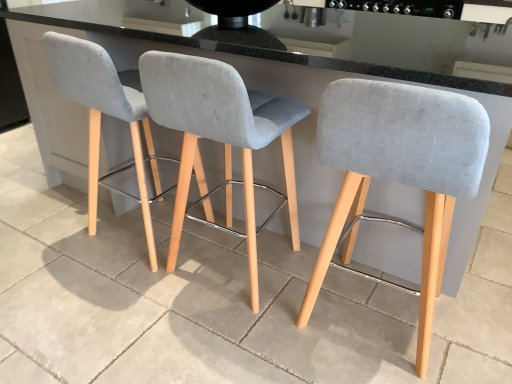
Question: Is black glossy stove at upper center at the back of light gray fabric stool at center, placed as the second chair when sorted from left to right?

Choices:
 (A) no
 (B) yes

Answer: (A)

Question: From a real-world perspective, is light gray fabric stool at center, placed as the second chair when sorted from left to right, located higher than black glossy stove at upper center?

Choices:
 (A) yes
 (B) no

Answer: (B)

Question: Does light gray fabric stool at center, placed as the second chair when sorted from left to right, come behind black glossy stove at upper center?

Choices:
 (A) yes
 (B) no

Answer: (B)

Question: Can you confirm if light gray fabric stool at center, the 2th chair positioned from the right, is positioned to the left of black glossy stove at upper center?

Choices:
 (A) yes
 (B) no

Answer: (A)

Question: Is light gray fabric stool at center, the 2th chair positioned from the right, positioned far away from black glossy stove at upper center?

Choices:
 (A) yes
 (B) no

Answer: (A)

Question: Which is correct: gray concrete at center is inside light gray fabric stool at left, the third chair when ordered from right to left, or outside of it?

Choices:
 (A) outside
 (B) inside

Answer: (A)

Question: From their relative heights in the image, would you say gray concrete at center is taller or shorter than light gray fabric stool at left, which appears as the first chair when viewed from the left?

Choices:
 (A) tall
 (B) short

Answer: (B)

Question: Considering the positions of gray concrete at center and light gray fabric stool at left, which appears as the first chair when viewed from the left, in the image, is gray concrete at center wider or thinner than light gray fabric stool at left, which appears as the first chair when viewed from the left,?

Choices:
 (A) wide
 (B) thin

Answer: (B)

Question: In the image, is gray concrete at center positioned in front of or behind light gray fabric stool at left, the third chair when ordered from right to left?

Choices:
 (A) front
 (B) behind

Answer: (A)

Question: From the image's perspective, relative to black glossy stove at upper center, is light gray fabric stool at left, which appears as the first chair when viewed from the left, above or below?

Choices:
 (A) below
 (B) above

Answer: (A)

Question: In the image, is light gray fabric stool at left, which appears as the first chair when viewed from the left, positioned in front of or behind black glossy stove at upper center?

Choices:
 (A) front
 (B) behind

Answer: (A)

Question: Considering the positions of light gray fabric stool at left, the third chair when ordered from right to left, and black glossy stove at upper center in the image, is light gray fabric stool at left, the third chair when ordered from right to left, bigger or smaller than black glossy stove at upper center?

Choices:
 (A) small
 (B) big

Answer: (B)

Question: Is light gray fabric stool at left, the third chair when ordered from right to left, wider or thinner than black glossy stove at upper center?

Choices:
 (A) wide
 (B) thin

Answer: (B)

Question: Is black glossy stove at upper center inside or outside of light gray fabric stool at left, which appears as the first chair when viewed from the left?

Choices:
 (A) inside
 (B) outside

Answer: (B)

Question: From the image's perspective, relative to light gray fabric stool at left, the third chair when ordered from right to left, is black glossy stove at upper center above or below?

Choices:
 (A) above
 (B) below

Answer: (A)